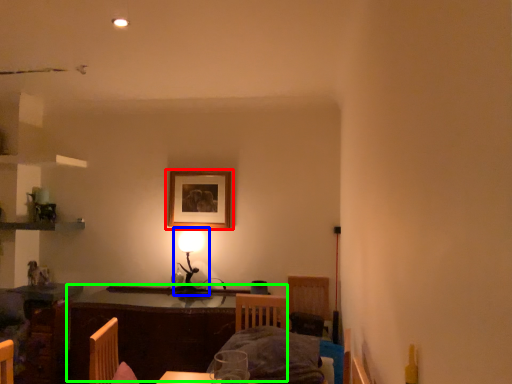
Question: Which object is positioned farthest from picture frame (highlighted by a red box)? Select from table lamp (highlighted by a blue box) and table (highlighted by a green box).

Choices:
 (A) table lamp
 (B) table

Answer: (B)